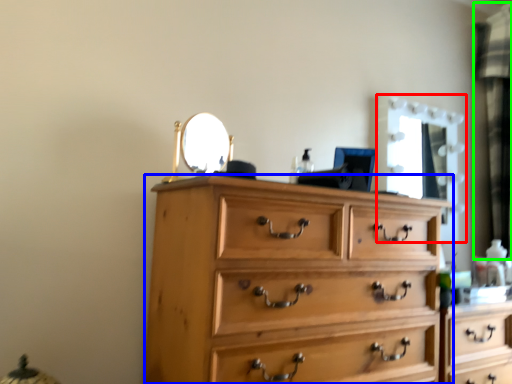
Question: Estimate the real-world distances between objects in this image. Which object is farther from mirror (highlighted by a red box), chest of drawers (highlighted by a blue box) or curtain (highlighted by a green box)?

Choices:
 (A) chest of drawers
 (B) curtain

Answer: (A)